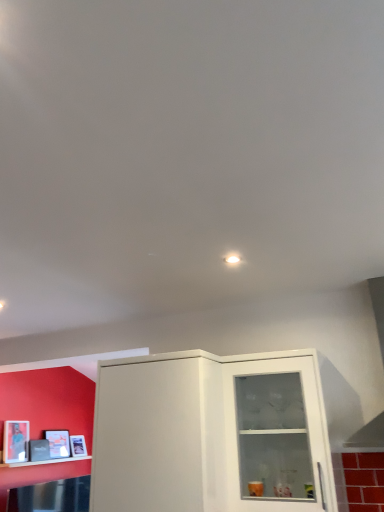
Question: In terms of width, does matte white cabinet at center look wider or thinner when compared to transparent glass cabinet at center?

Choices:
 (A) thin
 (B) wide

Answer: (B)

Question: From their relative heights in the image, would you say matte white cabinet at center is taller or shorter than transparent glass cabinet at center?

Choices:
 (A) tall
 (B) short

Answer: (A)

Question: Which is farther from the transparent glass cabinet at center?

Choices:
 (A) white glossy shelf at lower left
 (B) matte white cabinet at center

Answer: (A)

Question: Estimate the real-world distances between objects in this image. Which object is closer to the matte white cabinet at center?

Choices:
 (A) transparent glass cabinet at center
 (B) white glossy shelf at lower left

Answer: (A)